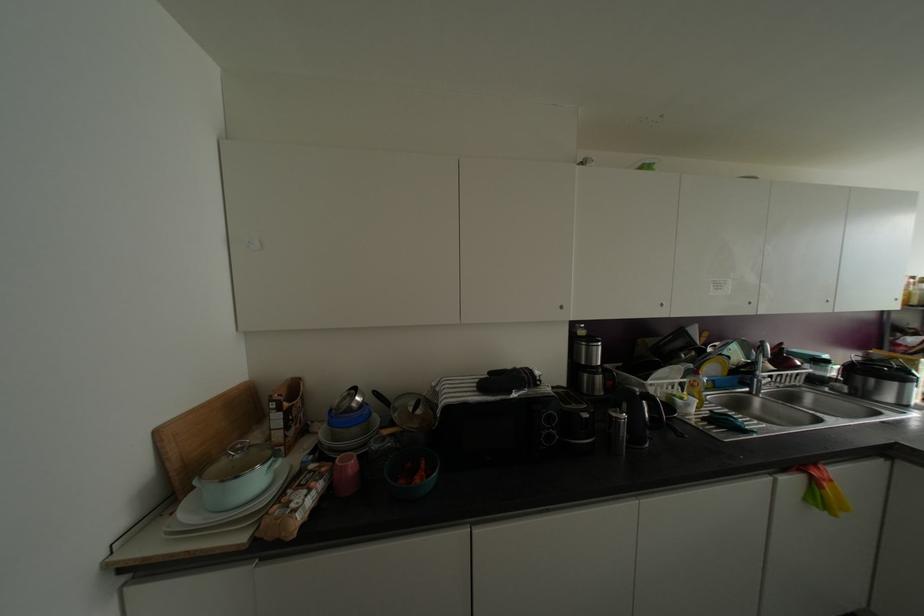
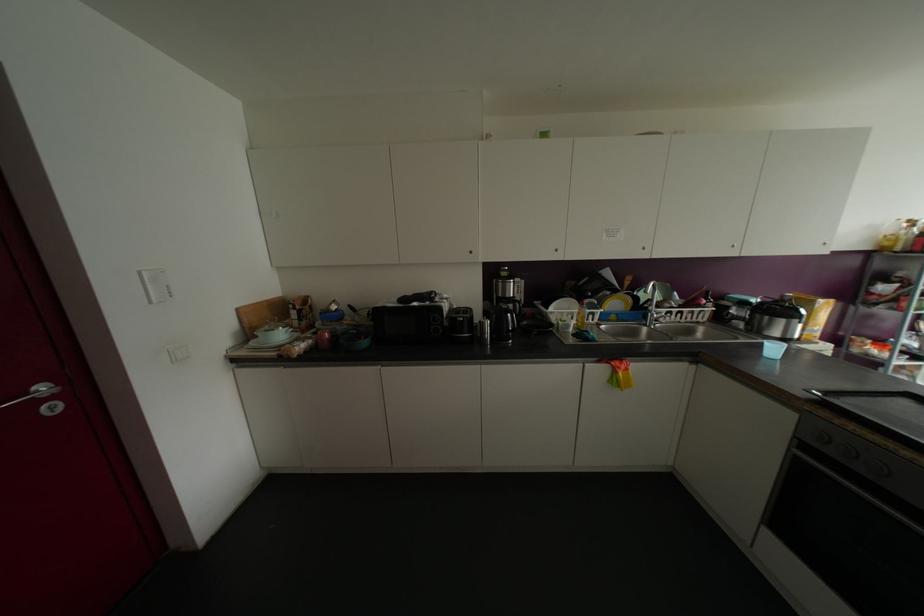
Find the pixel in the second image that matches point 256,480 in the first image.

(281, 334)